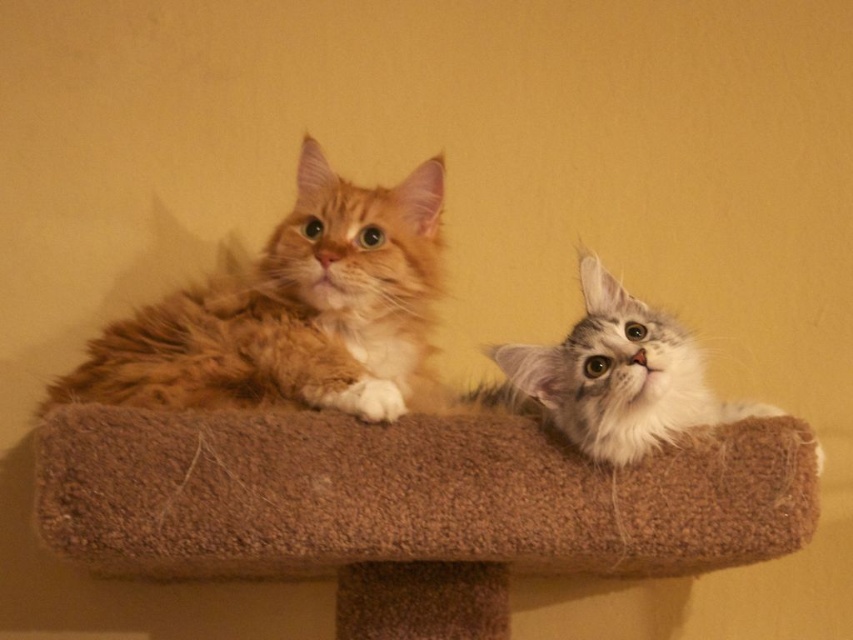
Does orange fur cat at upper left have a greater width compared to white fluffy cat at upper right?

Yes.

Who is positioned more to the right, orange fur cat at upper left or white fluffy cat at upper right?

From the viewer's perspective, white fluffy cat at upper right appears more on the right side.

Where is `orange fur cat at upper left`? This screenshot has height=640, width=853. orange fur cat at upper left is located at coordinates (291, 310).

Is point (601, 493) behind point (648, 388)?

Yes, point (601, 493) is farther from viewer.

Can you confirm if brown carpeted cat bed at center is shorter than white fluffy cat at upper right?

In fact, brown carpeted cat bed at center may be taller than white fluffy cat at upper right.

This screenshot has width=853, height=640. Describe the element at coordinates (409, 493) in the screenshot. I see `brown carpeted cat bed at center` at that location.

This screenshot has height=640, width=853. Identify the location of brown carpeted cat bed at center. (409, 493).

Can you confirm if brown carpeted cat bed at center is smaller than orange fur cat at upper left?

Actually, brown carpeted cat bed at center might be larger than orange fur cat at upper left.

Does point (187, 548) come farther from viewer compared to point (334, 316)?

That is False.

Does point (219, 433) come behind point (86, 380)?

No, (219, 433) is in front of (86, 380).

Where is `brown carpeted cat bed at center`? brown carpeted cat bed at center is located at coordinates (409, 493).